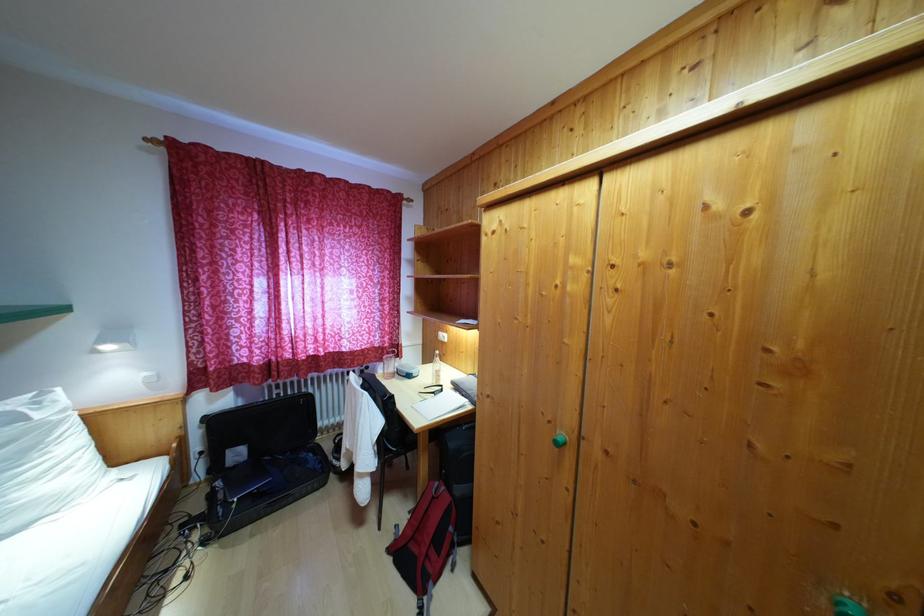
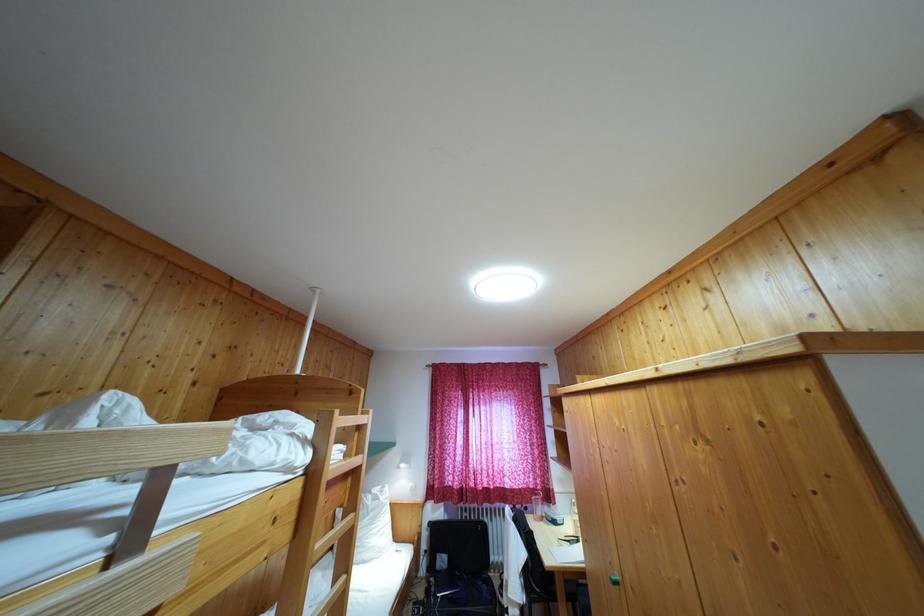
In the second image, find the point that corresponds to (392,360) in the first image.

(539, 501)